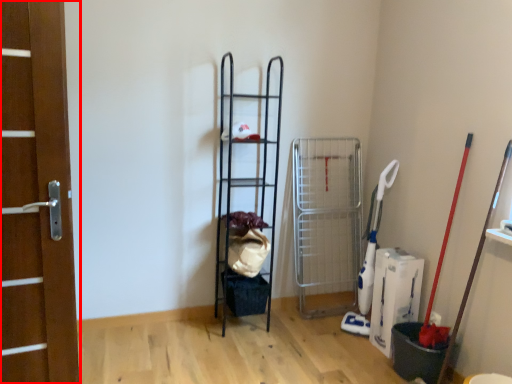
Question: Considering the relative positions of door (annotated by the red box) and ladder in the image provided, where is door (annotated by the red box) located with respect to the staircase?

Choices:
 (A) right
 (B) left

Answer: (B)